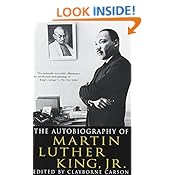
Find the location of a particular element. This screenshot has width=175, height=175. light colored wall is located at coordinates (86, 50).